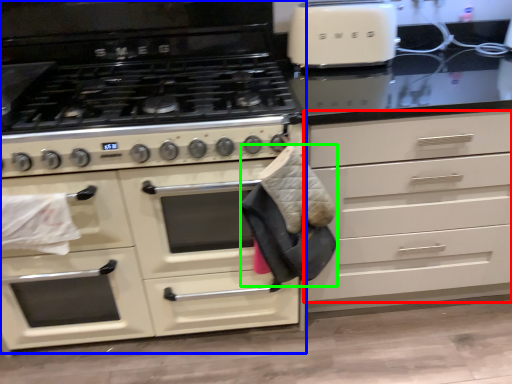
Question: Which object is the farthest from drawer (highlighted by a red box)? Choose among these: cabinetry (highlighted by a blue box) or material (highlighted by a green box).

Choices:
 (A) cabinetry
 (B) material

Answer: (A)